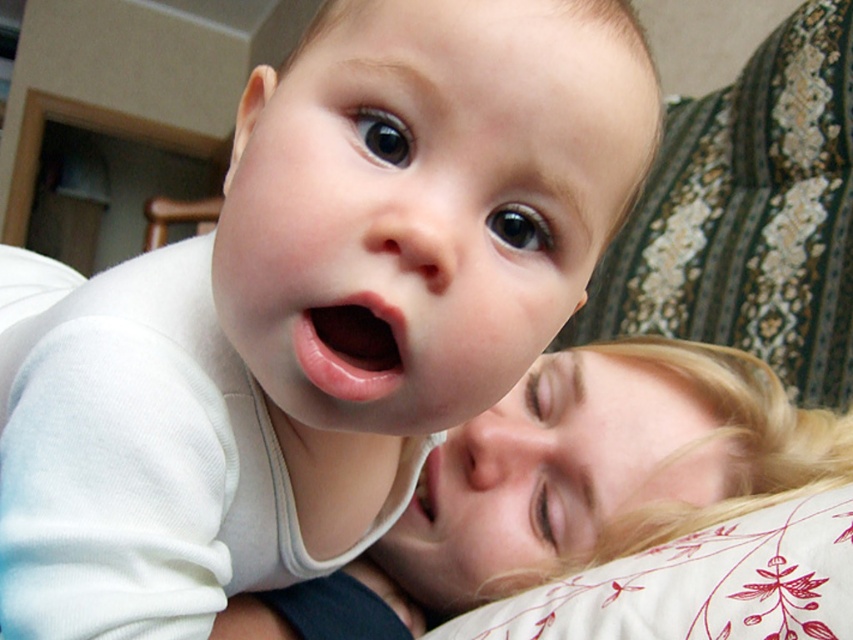
Question: Which point appears closest to the camera in this image?

Choices:
 (A) (741, 369)
 (B) (612, 628)

Answer: (B)

Question: Does smooth blonde hair at upper center come in front of white floral pillow at lower right?

Choices:
 (A) yes
 (B) no

Answer: (B)

Question: Is smooth blonde hair at upper center thinner than white floral pillow at lower right?

Choices:
 (A) yes
 (B) no

Answer: (B)

Question: Which point is closer to the camera?

Choices:
 (A) smooth blonde hair at upper center
 (B) white floral pillow at lower right

Answer: (B)

Question: Which point is closer to the camera?

Choices:
 (A) white floral pillow at lower right
 (B) smooth blonde hair at upper center

Answer: (A)

Question: Does smooth blonde hair at upper center lie behind white floral pillow at lower right?

Choices:
 (A) yes
 (B) no

Answer: (A)